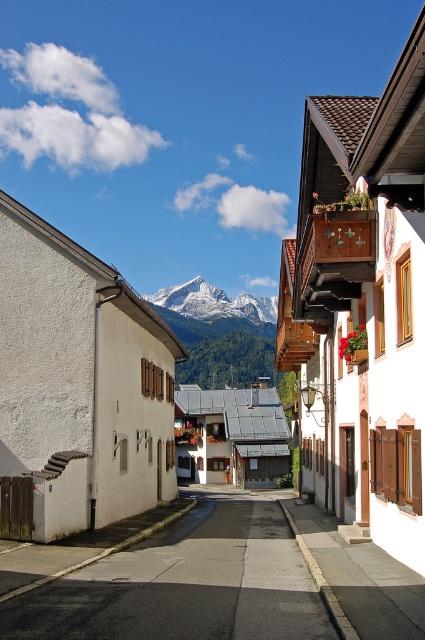
Question: Among these objects, which one is nearest to the camera?

Choices:
 (A) white snow-covered mountain at center
 (B) smooth asphalt road at center

Answer: (B)

Question: Can you confirm if smooth asphalt road at center is positioned to the right of white snow-covered mountain at center?

Choices:
 (A) no
 (B) yes

Answer: (B)

Question: Which point is farther to the camera?

Choices:
 (A) (265, 305)
 (B) (254, 552)

Answer: (A)

Question: Where is smooth asphalt road at center located in relation to white snow-covered mountain at center in the image?

Choices:
 (A) right
 (B) left

Answer: (A)

Question: Which object appears farthest from the camera in this image?

Choices:
 (A) white snow-covered mountain at center
 (B) smooth asphalt road at center

Answer: (A)

Question: Is smooth asphalt road at center behind white snow-covered mountain at center?

Choices:
 (A) yes
 (B) no

Answer: (B)